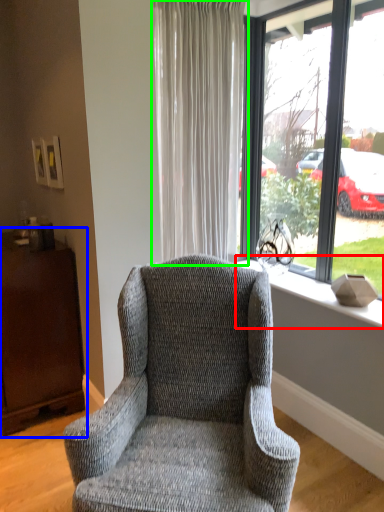
Question: Based on their relative distances, which object is farther from window sill (highlighted by a red box)? Choose from dresser (highlighted by a blue box) and curtain (highlighted by a green box).

Choices:
 (A) dresser
 (B) curtain

Answer: (A)